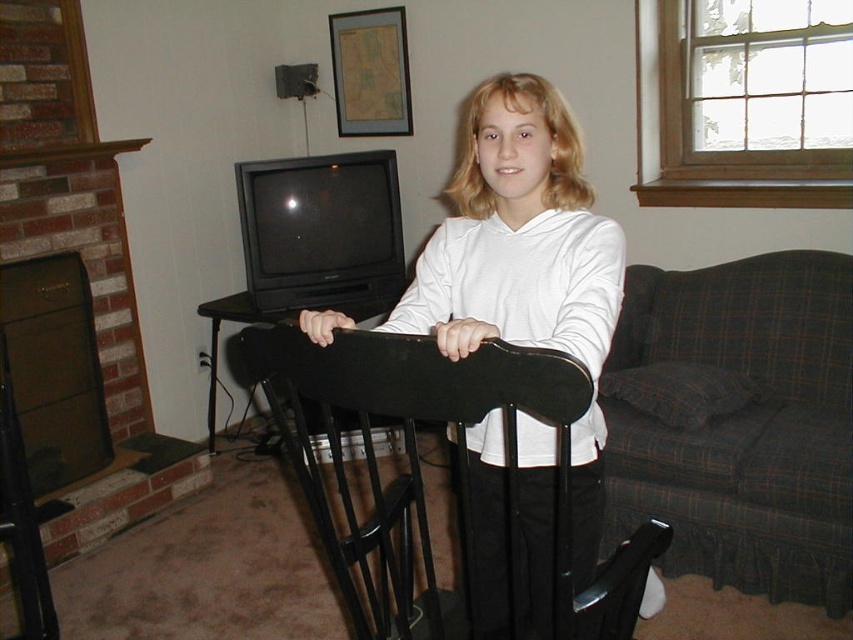
You are a visitor in this living room and you want to know which object is taller between the white matte hoodie at center and the black wood rocking chair at center. Can you tell me?

The white matte hoodie at center is much taller than the black wood rocking chair at center.

You are a guest in this living room and want to sit down. There is a white matte hoodie at center and a black wood rocking chair at center. Which object is closer to you?

The white matte hoodie at center is closer to you because the black wood rocking chair at center is behind it.